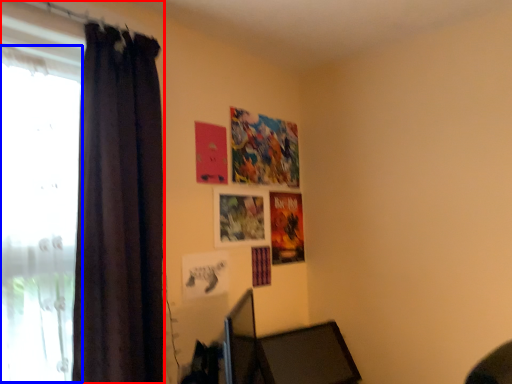
Question: Which point is further to the camera, curtain (highlighted by a red box) or window (highlighted by a blue box)?

Choices:
 (A) curtain
 (B) window

Answer: (A)